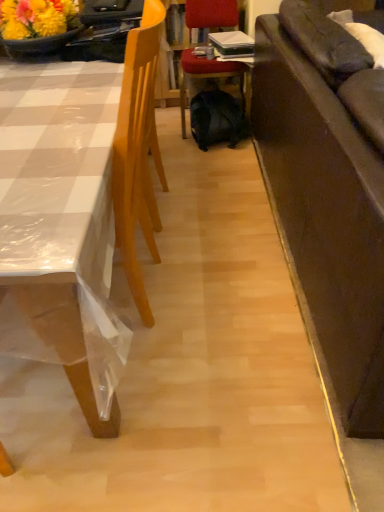
Question: Does velvet red chair at center, arranged as the 1th chair when viewed from the right, have a lesser height compared to dark brown leather couch at right?

Choices:
 (A) no
 (B) yes

Answer: (B)

Question: Is the depth of velvet red chair at center, placed as the second chair when sorted from left to right, greater than that of dark brown leather couch at right?

Choices:
 (A) yes
 (B) no

Answer: (A)

Question: From a real-world perspective, is velvet red chair at center, arranged as the 1th chair when viewed from the right, physically below dark brown leather couch at right?

Choices:
 (A) yes
 (B) no

Answer: (A)

Question: Is velvet red chair at center, placed as the second chair when sorted from left to right, oriented towards dark brown leather couch at right?

Choices:
 (A) no
 (B) yes

Answer: (A)

Question: Is velvet red chair at center, placed as the second chair when sorted from left to right, to the right of dark brown leather couch at right from the viewer's perspective?

Choices:
 (A) yes
 (B) no

Answer: (B)

Question: Based on their positions, is light wood chair at left, placed as the first chair when sorted from left to right, located to the left or right of dark brown leather couch at right?

Choices:
 (A) right
 (B) left

Answer: (B)

Question: Based on their sizes in the image, would you say light wood chair at left, placed as the first chair when sorted from left to right, is bigger or smaller than dark brown leather couch at right?

Choices:
 (A) big
 (B) small

Answer: (A)

Question: In terms of width, does light wood chair at left, the 2th chair when ordered from right to left, look wider or thinner when compared to dark brown leather couch at right?

Choices:
 (A) wide
 (B) thin

Answer: (A)

Question: Does point (56, 228) appear closer or farther from the camera than point (332, 148)?

Choices:
 (A) farther
 (B) closer

Answer: (B)

Question: Considering the relative positions of dark brown leather couch at right and black matte backpack at center in the image provided, is dark brown leather couch at right to the left or to the right of black matte backpack at center?

Choices:
 (A) right
 (B) left

Answer: (A)

Question: Is dark brown leather couch at right taller or shorter than black matte backpack at center?

Choices:
 (A) tall
 (B) short

Answer: (A)

Question: Does point (297, 70) appear closer or farther from the camera than point (200, 146)?

Choices:
 (A) farther
 (B) closer

Answer: (B)

Question: Which is correct: dark brown leather couch at right is inside black matte backpack at center, or outside of it?

Choices:
 (A) outside
 (B) inside

Answer: (A)

Question: Looking at the image, does black matte backpack at center seem bigger or smaller compared to velvet red chair at center, placed as the second chair when sorted from left to right?

Choices:
 (A) big
 (B) small

Answer: (B)

Question: Is black matte backpack at center to the left or to the right of velvet red chair at center, placed as the second chair when sorted from left to right, in the image?

Choices:
 (A) left
 (B) right

Answer: (B)